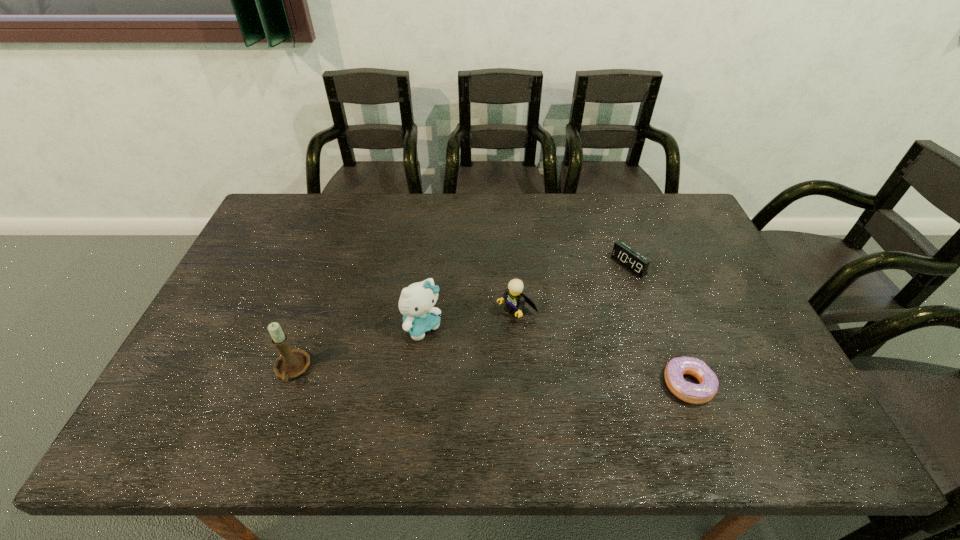
Where is `free spot on the desktop that is between the candle holder and the shortest object and is positioned on the front-facing side of the Lego`? This screenshot has height=540, width=960. free spot on the desktop that is between the candle holder and the shortest object and is positioned on the front-facing side of the Lego is located at coordinates (433, 375).

Where is `vacant spot on the desktop that is between the leftmost object and the doughnut and is positioned on the front-facing side of the farthest object`? The image size is (960, 540). vacant spot on the desktop that is between the leftmost object and the doughnut and is positioned on the front-facing side of the farthest object is located at coordinates (445, 376).

Where is `vacant spot on the desktop that is between the candle holder and the doughnut and is positioned on the face of the kitten`? vacant spot on the desktop that is between the candle holder and the doughnut and is positioned on the face of the kitten is located at coordinates (468, 377).